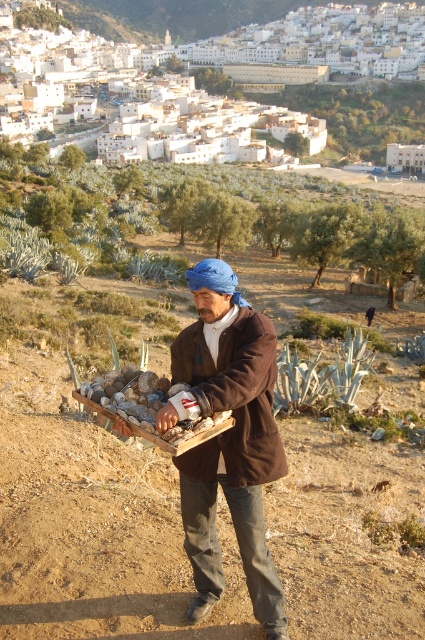
The man in the scene is wearing two items of clothing at the center. Which one is taller, the brown woolen coat at center or the brown woolen jacket at center?

The brown woolen coat at center is taller than the brown woolen jacket at center according to the description.

You are a traveler in this rural area and notice two items on the man in the foreground. Which one is positioned lower on his body, the brown woolen coat at center or the brown woolen jacket at center?

The brown woolen coat at center is located below the brown woolen jacket at center, so the coat is positioned lower on his body.